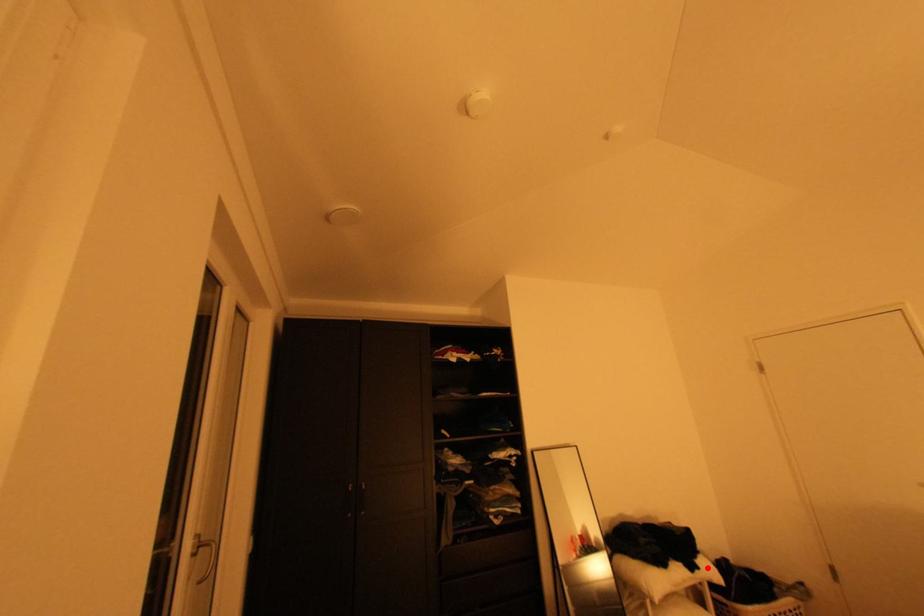
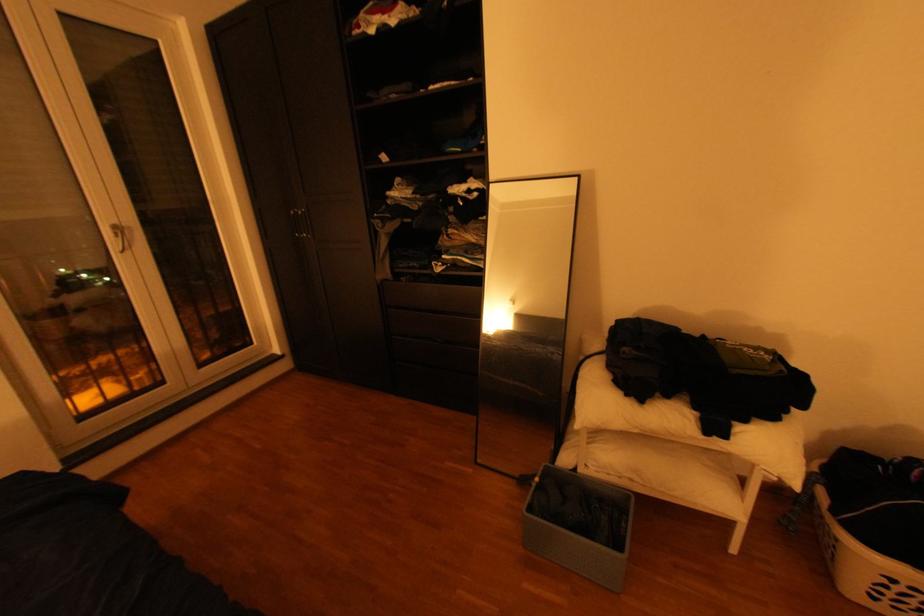
Question: I am providing you with two images of the same scene from different viewpoints. A red point is shown in image1. For the corresponding object point in image2, is it positioned nearer or farther from the camera?

Choices:
 (A) Nearer
 (B) Farther

Answer: (B)